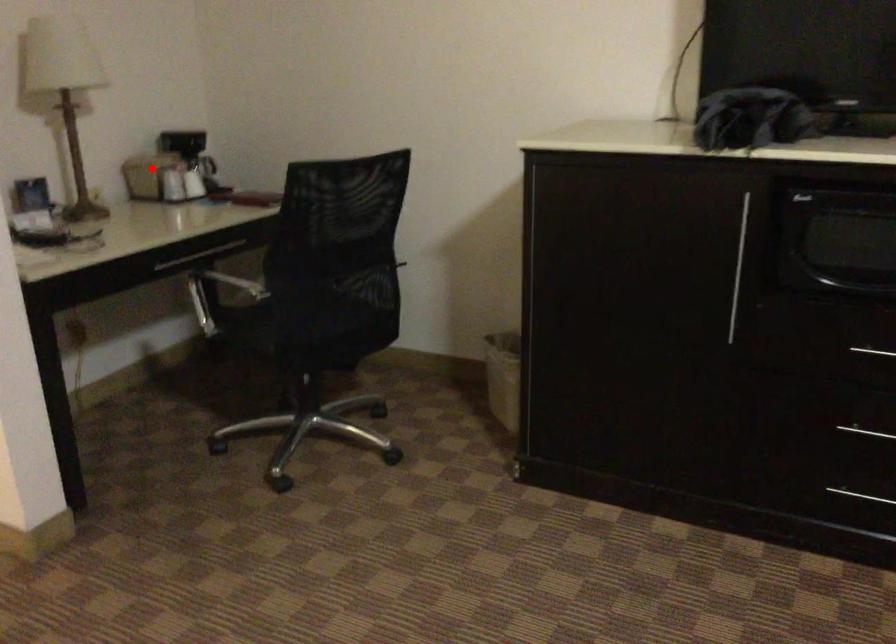
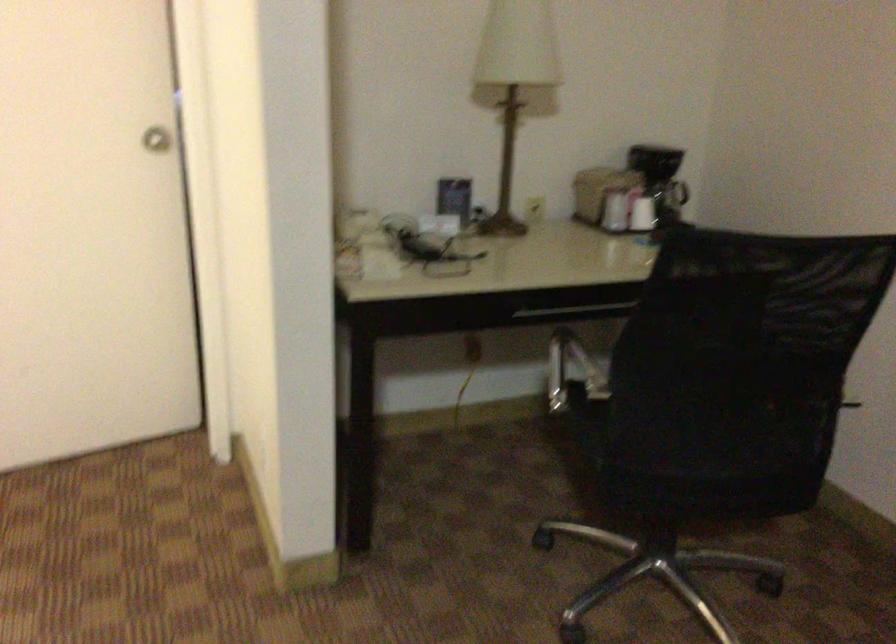
Question: I am providing you with two images of the same scene from different viewpoints. Image1 has a red point marked. In image2, the corresponding 3D location appears at what relative position? Reply with the corresponding letter.

Choices:
 (A) Closer
 (B) Farther

Answer: (A)